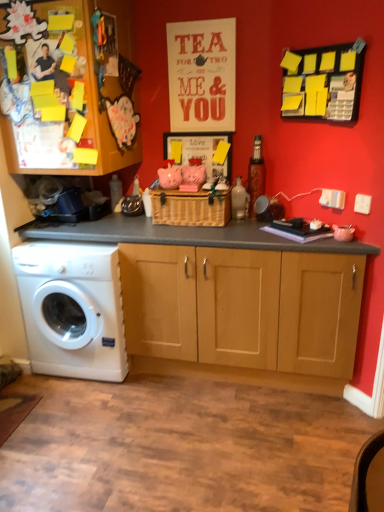
Question: Is point (168, 223) positioned closer to the camera than point (301, 55)?

Choices:
 (A) closer
 (B) farther

Answer: (B)

Question: Is woven brown basket at center wider or thinner than yellow sticky notes at upper right?

Choices:
 (A) wide
 (B) thin

Answer: (A)

Question: Which is nearer to the woven brown basket at center?

Choices:
 (A) yellow sticky notes at upper right
 (B) white plastic washing machine at lower left
 (C) wooden cabinet at center

Answer: (C)

Question: Based on their relative distances, which object is farther from the white plastic washing machine at lower left?

Choices:
 (A) woven brown basket at center
 (B) wooden cabinet at center
 (C) yellow sticky notes at upper right

Answer: (C)